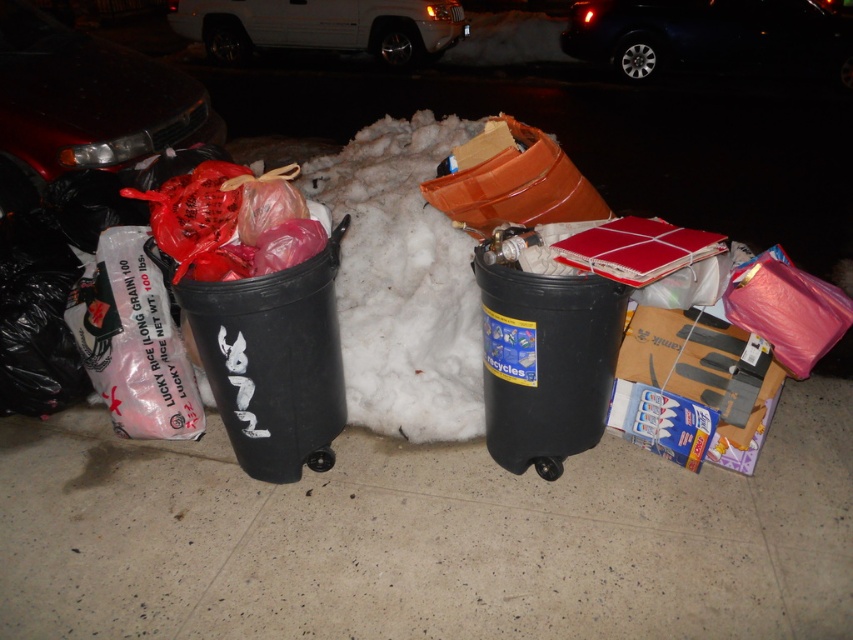
You are a delivery person who needs to park your 2.5 meter long delivery van. You see the smooth concrete pavement at center and the shiny black car at upper right in the scene. Which area can accommodate your van?

The shiny black car at upper right is larger than the smooth concrete pavement at center, so the van can only fit in the area where the shiny black car at upper right is parked.

You are standing at the origin point of the coordinate system. You want to move towards the black plastic trash can at left. What are the coordinates you need to move to reach it?

The coordinates to reach the black plastic trash can at left are at point (273, 362).